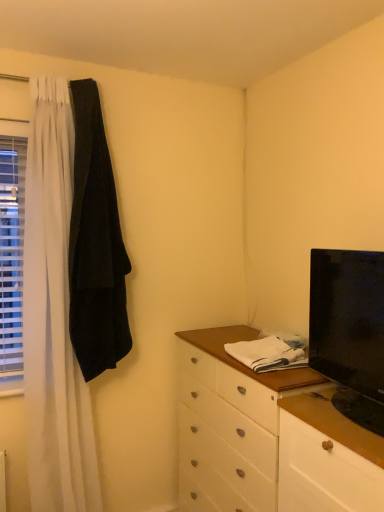
What do you see at coordinates (95, 244) in the screenshot?
I see `black velvet robe at left` at bounding box center [95, 244].

What is the approximate height of black glossy tv at right?

48.54 centimeters.

At what (x,y) coordinates should I click in order to perform the action: click on white plastic blinds at left. Please return your answer as a coordinate pair (x, y). Looking at the image, I should click on (12, 254).

Locate an element on the screen. black velvet robe at left is located at coordinates (x=95, y=244).

Considering the sizes of objects white plastic blinds at left and black glossy tv at right in the image provided, who is taller, white plastic blinds at left or black glossy tv at right?

Standing taller between the two is white plastic blinds at left.

Is black glossy tv at right a part of white plastic blinds at left?

Definitely not — black glossy tv at right is not inside white plastic blinds at left.

Looking at this image, from a real-world perspective, which object rests below the other?

black glossy tv at right is physically lower.

Looking at this image, between white plastic blinds at left and black glossy tv at right, which one is positioned behind?

white plastic blinds at left.

Which object is wider, black glossy tv at right or black velvet robe at left?

black glossy tv at right.

Which object is closer to the camera, black glossy tv at right or black velvet robe at left?

black glossy tv at right is in front.

Is black glossy tv at right at the right side of black velvet robe at left?

Yes.

From the image's perspective, which one is positioned higher, black glossy tv at right or black velvet robe at left?

black velvet robe at left is shown above in the image.

From a real-world perspective, is white plastic blinds at left beneath white wood counter top at center?

No, from a real-world perspective, white plastic blinds at left is not under white wood counter top at center.

Is there a large distance between white plastic blinds at left and white wood counter top at center?

No, there isn't a large distance between white plastic blinds at left and white wood counter top at center.

What's the angular difference between white plastic blinds at left and white wood counter top at center's facing directions?

There is a 94.9-degree angle between the facing directions of white plastic blinds at left and white wood counter top at center.

From the image's perspective, which is above, white plastic blinds at left or white wood counter top at center?

white plastic blinds at left.

Relative to white plastic blinds at left, is black glossy tv at right in front or behind?

Visually, black glossy tv at right is located in front of white plastic blinds at left.

Does black glossy tv at right touch white plastic blinds at left?

No, black glossy tv at right is not with white plastic blinds at left.

Is black glossy tv at right facing away from white plastic blinds at left?

No.

How distant is black velvet robe at left from black glossy tv at right?

black velvet robe at left and black glossy tv at right are 93.80 centimeters apart from each other.

Can you tell me how much black velvet robe at left and black glossy tv at right differ in facing direction?

The angle between the facing direction of black velvet robe at left and the facing direction of black glossy tv at right is 92.9 degrees.

Choose the correct answer: Is black velvet robe at left inside black glossy tv at right or outside it?

black velvet robe at left lies outside black glossy tv at right.

Considering their positions, is black velvet robe at left located in front of or behind black glossy tv at right?

Clearly, black velvet robe at left is behind black glossy tv at right.

Find the location of a particular element. This screenshot has width=384, height=512. counter top below the black glossy tv at right (from the image's perspective) is located at coordinates (245, 365).

How many degrees apart are the facing directions of black glossy tv at right and white wood counter top at center?

They differ by 5.29 degrees in their facing directions.

Is black glossy tv at right further to the viewer compared to white wood counter top at center?

That is False.

Considering the sizes of objects black glossy tv at right and white wood counter top at center in the image provided, who is thinner, black glossy tv at right or white wood counter top at center?

With smaller width is black glossy tv at right.

Can you confirm if black velvet robe at left is shorter than white plastic blinds at left?

In fact, black velvet robe at left may be taller than white plastic blinds at left.

Which object is closer to the camera, black velvet robe at left or white plastic blinds at left?

black velvet robe at left is closer to the camera.

Choose the correct answer: Is black velvet robe at left inside white plastic blinds at left or outside it?

black velvet robe at left is not enclosed by white plastic blinds at left.

From a real-world perspective, who is located lower, black velvet robe at left or white plastic blinds at left?

From a 3D spatial view, white plastic blinds at left is below.

Locate an element on the screen. This screenshot has width=384, height=512. window above the black glossy tv at right (from a real-world perspective) is located at coordinates (12, 254).

Find the location of a particular element. Image resolution: width=384 pixels, height=512 pixels. robe to the left of black glossy tv at right is located at coordinates (95, 244).

Based on their spatial positions, is white wood counter top at center or black glossy tv at right further from white plastic blinds at left?

The object further to white plastic blinds at left is black glossy tv at right.

Considering their positions, is black velvet robe at left positioned further to black glossy tv at right than white plastic blinds at left?

white plastic blinds at left is positioned further to the anchor black glossy tv at right.

Which object lies nearer to the anchor point black glossy tv at right, white wood counter top at center or black velvet robe at left?

The object closer to black glossy tv at right is white wood counter top at center.

Looking at the image, which one is located further to black velvet robe at left, white plastic blinds at left or white wood counter top at center?

Among the two, white wood counter top at center is located further to black velvet robe at left.

Estimate the real-world distances between objects in this image. Which object is closer to white wood counter top at center, black glossy tv at right or black velvet robe at left?

black glossy tv at right is positioned closer to the anchor white wood counter top at center.

When comparing their distances from white plastic blinds at left, does black velvet robe at left or black glossy tv at right seem closer?

Based on the image, black velvet robe at left appears to be nearer to white plastic blinds at left.

Considering their positions, is white plastic blinds at left positioned further to black glossy tv at right than black velvet robe at left?

The object further to black glossy tv at right is white plastic blinds at left.

Looking at the image, which one is located closer to white plastic blinds at left, black glossy tv at right or black velvet robe at left?

black velvet robe at left is positioned closer to the anchor white plastic blinds at left.

Locate an element on the screen. counter top situated between white plastic blinds at left and black glossy tv at right from left to right is located at coordinates (245, 365).

This screenshot has width=384, height=512. I want to click on robe between white plastic blinds at left and black glossy tv at right from left to right, so click(95, 244).

Identify the location of robe located between white plastic blinds at left and white wood counter top at center in the left-right direction. The image size is (384, 512). (95, 244).

Where is `counter top between black velvet robe at left and black glossy tv at right`? The width and height of the screenshot is (384, 512). counter top between black velvet robe at left and black glossy tv at right is located at coordinates (245, 365).